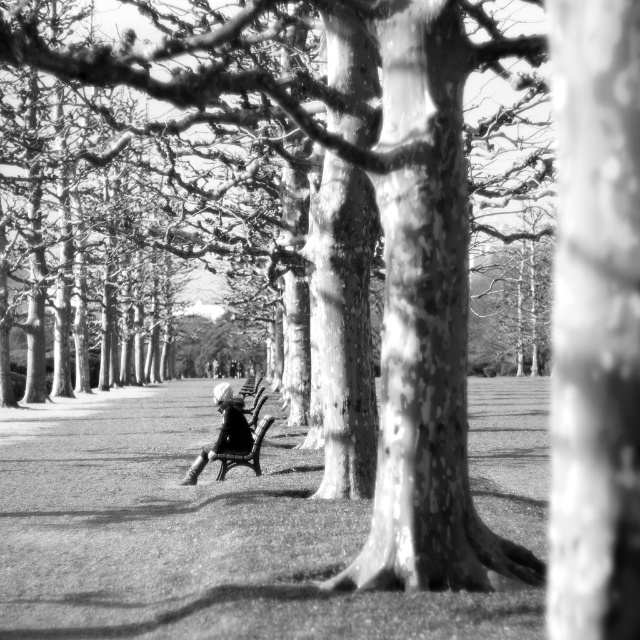
You are a photographer trying to capture the scene with the white fabric jacket at center and the black wood bench at center. Which object is located to the left of the other?

The white fabric jacket at center is positioned on the left side of black wood bench at center.

You are a photographer trying to capture the person wearing the white fabric jacket at center in your shot. Based on the scene, where should you position your camera to ensure the jacket is centered in the frame?

To center the white fabric jacket at center in the frame, position your camera directly facing the jacket at point coordinates (224, 433), ensuring the jacket is aligned with the frame center.